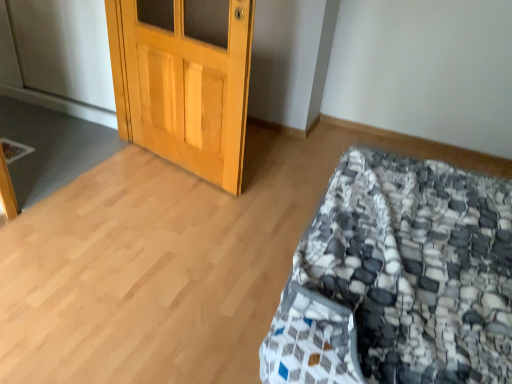
Question: Choose the correct answer: Is textured gray and white quilt at lower right inside wooden door at upper left or outside it?

Choices:
 (A) outside
 (B) inside

Answer: (A)

Question: From a real-world perspective, is textured gray and white quilt at lower right positioned above or below wooden door at upper left?

Choices:
 (A) above
 (B) below

Answer: (B)

Question: Considering the relative positions of textured gray and white quilt at lower right and wooden door at upper left in the image provided, is textured gray and white quilt at lower right to the left or to the right of wooden door at upper left?

Choices:
 (A) right
 (B) left

Answer: (A)

Question: Is wooden door at upper left to the left or to the right of textured gray and white quilt at lower right in the image?

Choices:
 (A) left
 (B) right

Answer: (A)

Question: From a real-world perspective, is wooden door at upper left positioned above or below textured gray and white quilt at lower right?

Choices:
 (A) above
 (B) below

Answer: (A)

Question: Is wooden door at upper left wider or thinner than textured gray and white quilt at lower right?

Choices:
 (A) thin
 (B) wide

Answer: (A)

Question: From the image's perspective, is wooden door at upper left above or below textured gray and white quilt at lower right?

Choices:
 (A) above
 (B) below

Answer: (A)